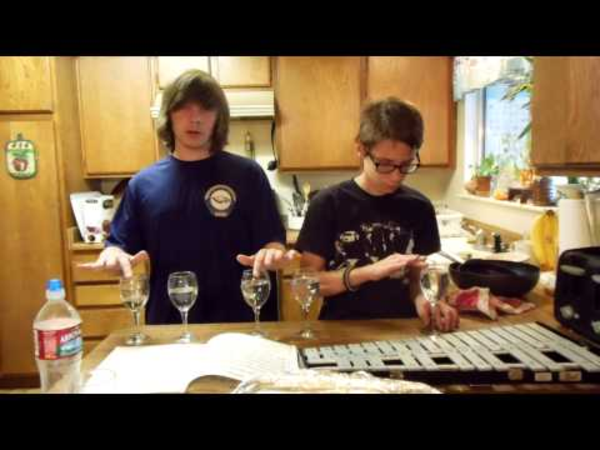
I want to click on curtain, so click(482, 75).